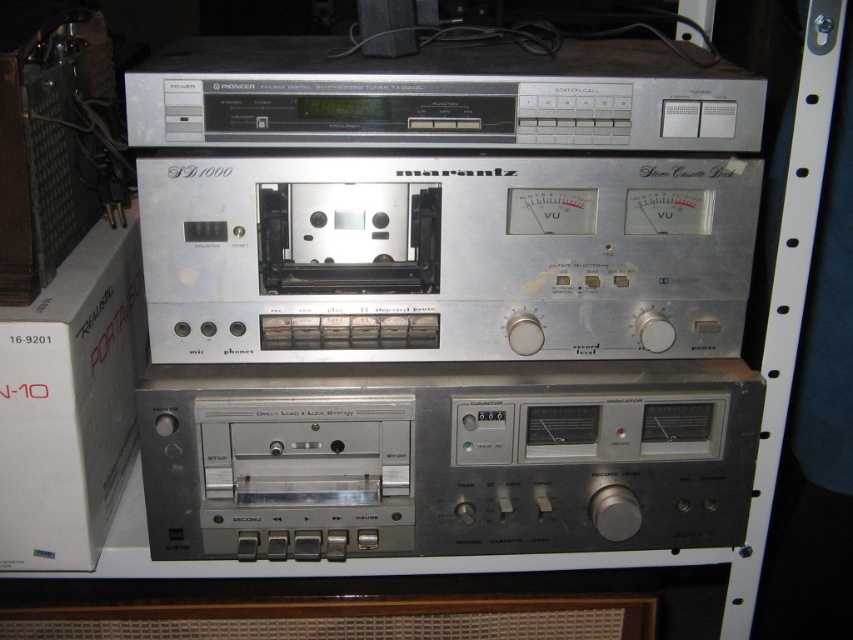
You are organizing a vintage audio equipment collection and need to locate the silver metallic cassette at center. According to the coordinates given, where would you find it?

The silver metallic cassette at center is located at point (445,257).